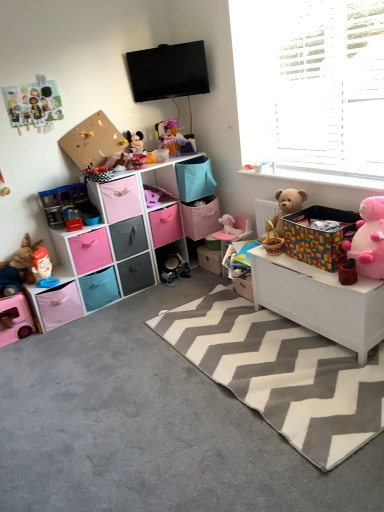
Question: Is gray chevron rug at center inside the boundaries of matte cardboard box at center, which is the 3th storage box in left-to-right order, or outside?

Choices:
 (A) outside
 (B) inside

Answer: (A)

Question: From the image's perspective, is gray chevron rug at center located above or below matte cardboard box at center, which is the 3th storage box in left-to-right order?

Choices:
 (A) below
 (B) above

Answer: (A)

Question: Based on their relative distances, which object is nearer to the matte plastic toy at left, which is the sixth toy from right to left?

Choices:
 (A) white wooden blinds at upper right
 (B) fluffy beige teddy bear at right, placed as the 2th teddy bear when sorted from front to back
 (C) pink fabric drawer at left, which is the fourth drawer in top-to-bottom order
 (D) gray chevron rug at center
 (E) pink plush teddy bear at right, the 1th teddy bear in the front-to-back sequence

Answer: (C)

Question: Which of these objects is positioned closest to the matte plastic toy at left, the second toy positioned from the left?

Choices:
 (A) gray chevron rug at center
 (B) gray carpet at lower left
 (C) matte plastic mickey mouse at center, the fifth toy viewed from the left
 (D) pink plastic toy car at lower left, positioned as the 1th toy in left-to-right order
 (E) pink fabric storage box at center, the 3th storage box when ordered from right to left

Answer: (D)